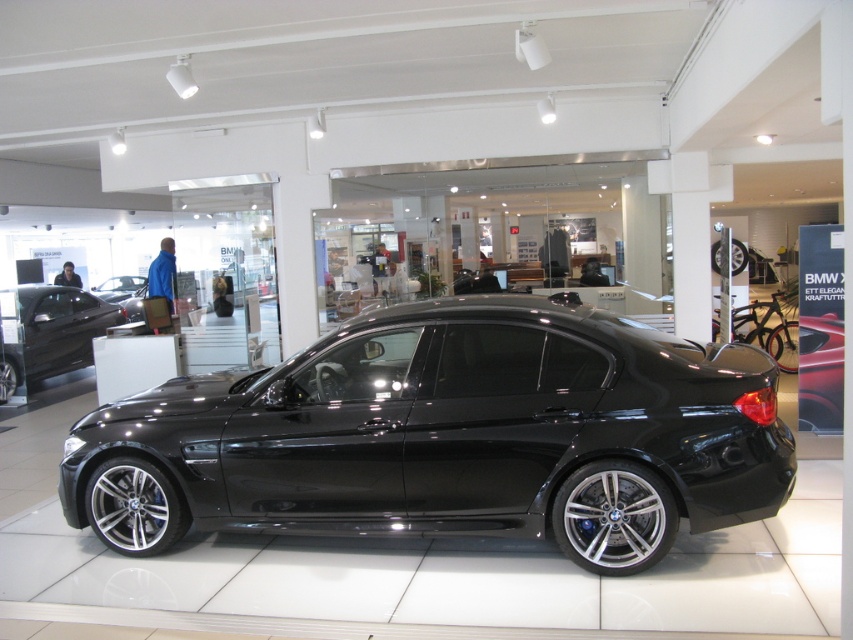
Who is higher up, black metallic car at center or glossy black car at center?

glossy black car at center is above.

Does black metallic car at center come in front of glossy black car at center?

Yes, it is.

The height and width of the screenshot is (640, 853). Identify the location of black metallic car at center. (448, 436).

This screenshot has height=640, width=853. What do you see at coordinates (51, 332) in the screenshot? I see `matte black sedan at left` at bounding box center [51, 332].

Can you confirm if matte black sedan at left is smaller than glossy black car at center?

No.

Locate an element on the screen. The width and height of the screenshot is (853, 640). matte black sedan at left is located at coordinates (51, 332).

This screenshot has width=853, height=640. Describe the element at coordinates (448, 436) in the screenshot. I see `black metallic car at center` at that location.

Can you confirm if black metallic car at center is shorter than matte black sedan at left?

Indeed, black metallic car at center has a lesser height compared to matte black sedan at left.

Between point (546, 390) and point (125, 317), which one is positioned behind?

The point (125, 317) is more distant.

This screenshot has height=640, width=853. I want to click on black metallic car at center, so click(448, 436).